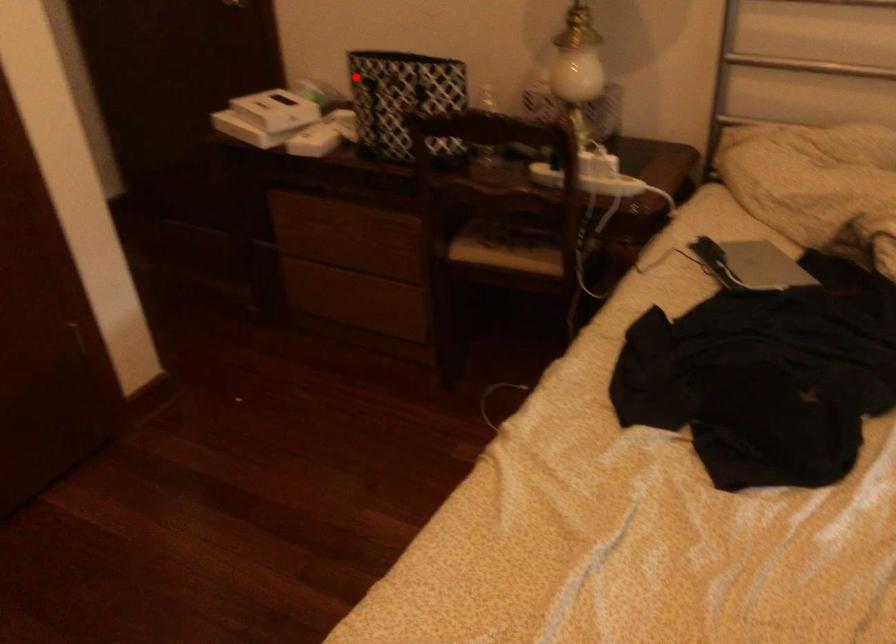
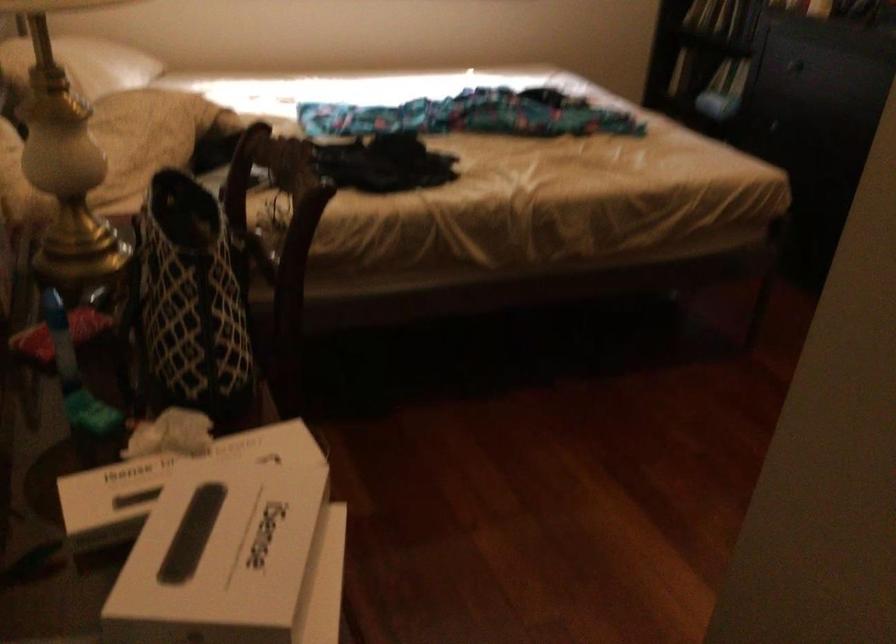
Where in the second image is the point corresponding to the highlighted location from the first image?

(188, 301)